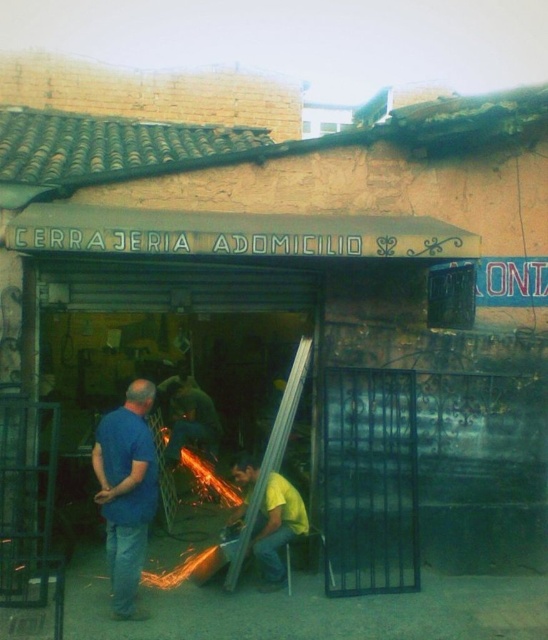
Question: Is blue matte shirt at center behind green fabric shirt at center?

Choices:
 (A) yes
 (B) no

Answer: (B)

Question: Is blue matte shirt at center wider than yellow matte shirt at center?

Choices:
 (A) yes
 (B) no

Answer: (B)

Question: Which of these objects is positioned closest to the blue matte shirt at center?

Choices:
 (A) green fabric shirt at center
 (B) yellow matte shirt at center

Answer: (B)

Question: Which of the following is the closest to the observer?

Choices:
 (A) green fabric shirt at center
 (B) yellow matte shirt at center
 (C) blue matte shirt at center

Answer: (C)

Question: Does yellow matte shirt at center have a larger size compared to green fabric shirt at center?

Choices:
 (A) yes
 (B) no

Answer: (B)

Question: Estimate the real-world distances between objects in this image. Which object is closer to the blue matte shirt at center?

Choices:
 (A) yellow matte shirt at center
 (B) green fabric shirt at center

Answer: (A)